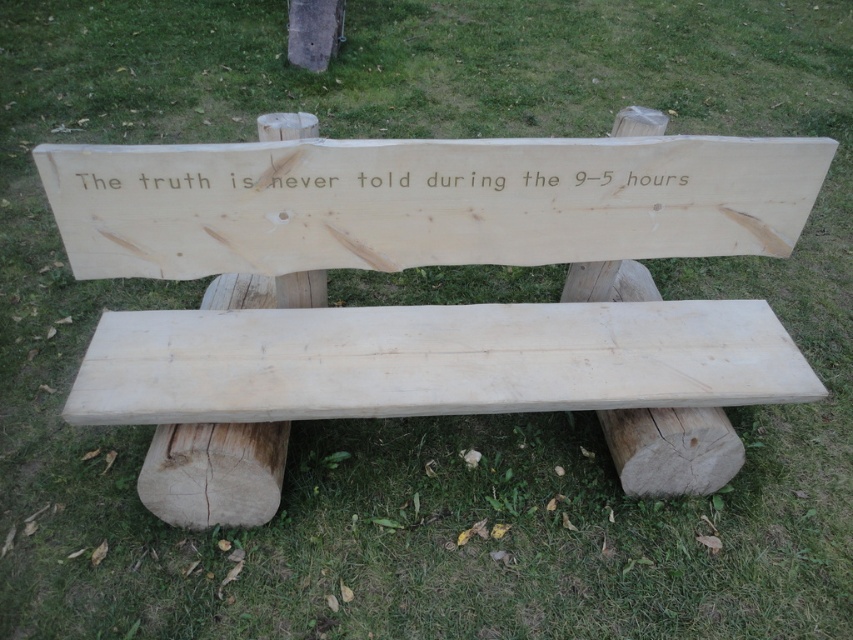
Can you confirm if natural wood sign at center is bigger than white wood text at center?

Indeed, natural wood sign at center has a larger size compared to white wood text at center.

From the picture: Is natural wood sign at center to the left of white wood text at center from the viewer's perspective?

Incorrect, natural wood sign at center is not on the left side of white wood text at center.

This screenshot has width=853, height=640. Find the location of `natural wood sign at center`. natural wood sign at center is located at coordinates (424, 202).